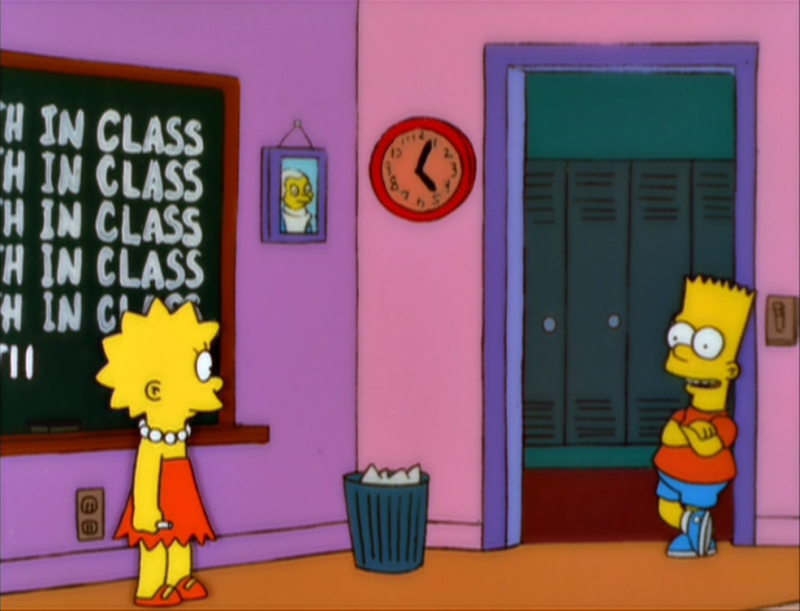
Locate an element on the screen. The image size is (800, 611). switch is located at coordinates (778, 323).